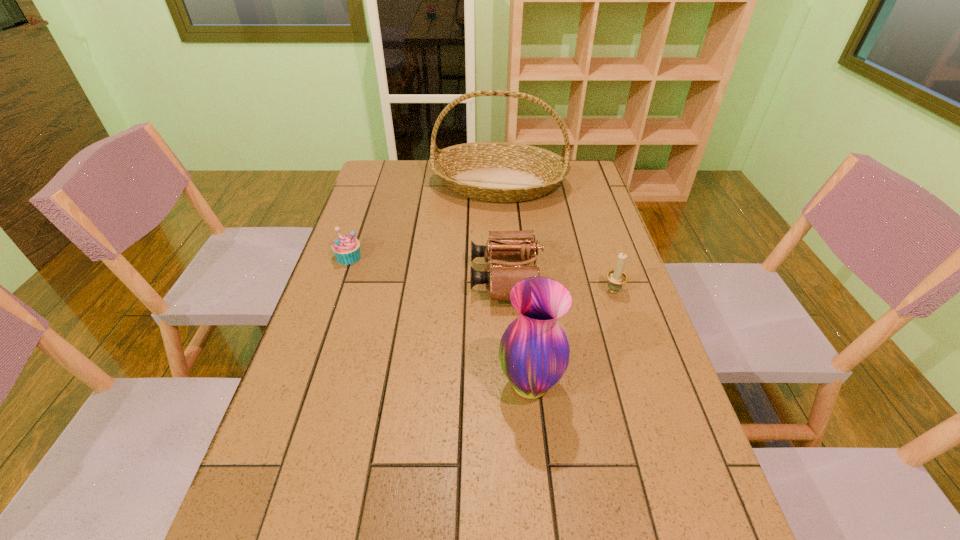
This screenshot has width=960, height=540. Find the location of `free location located 0.220m on the handle side of the candle_holder`. free location located 0.220m on the handle side of the candle_holder is located at coordinates (595, 233).

Locate an element on the screen. The height and width of the screenshot is (540, 960). vacant space located 0.310m on the handle side of the candle_holder is located at coordinates (589, 218).

You are a GUI agent. You are given a task and a screenshot of the screen. Output one action in this format:
    pyautogui.click(x=<x>, y=<y>)
    Task: Click on the free region located on the handle side of the candle_holder
    This screenshot has width=960, height=540.
    Given the screenshot: What is the action you would take?
    pyautogui.click(x=605, y=264)

The width and height of the screenshot is (960, 540). In order to click on vacant space located through the eyepieces of the binoculars in this screenshot , I will do `click(418, 278)`.

Image resolution: width=960 pixels, height=540 pixels. Identify the location of vacant position located 0.090m through the eyepieces of the binoculars. (440, 278).

Locate an element on the screen. The width and height of the screenshot is (960, 540). vacant space located through the eyepieces of the binoculars is located at coordinates (404, 278).

At what (x,y) coordinates should I click in order to perform the action: click on free location located 0.390m on the right of the leftmost object. Please return your answer as a coordinate pair (x, y). This screenshot has width=960, height=540. Looking at the image, I should click on (493, 256).

Image resolution: width=960 pixels, height=540 pixels. I want to click on object present at the far edge, so click(504, 172).

This screenshot has height=540, width=960. I want to click on object present at the left edge, so click(346, 248).

The width and height of the screenshot is (960, 540). I want to click on basket that is at the right edge, so click(504, 172).